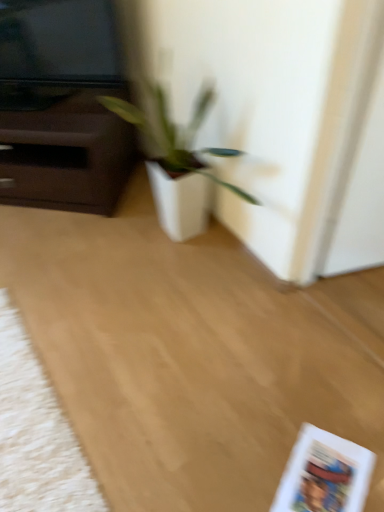
Identify the location of vacant area situated to the left side of white matte paperback book at lower right. The width and height of the screenshot is (384, 512). (251, 461).